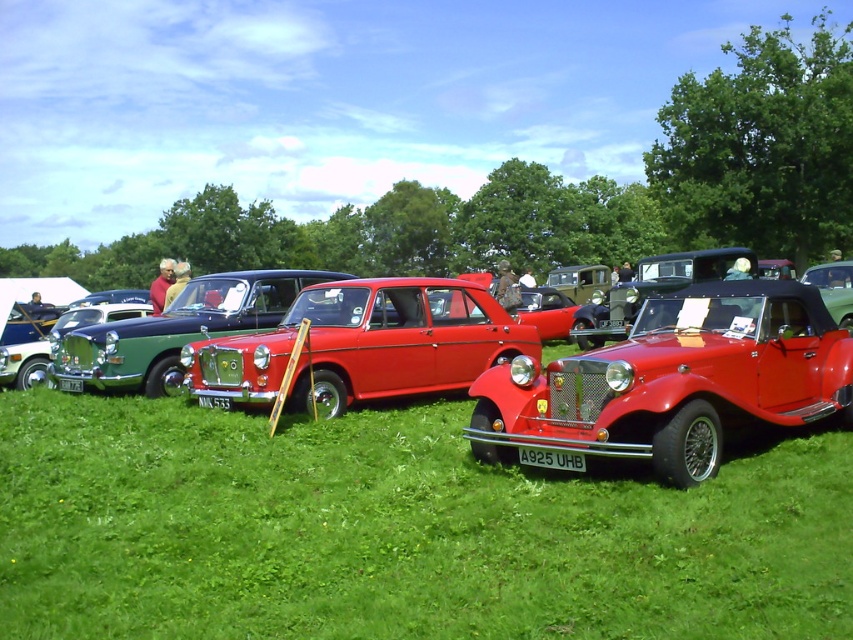
You are standing at the viewpoint of the image and see two points marked on the ground. The first point is at coordinate point(799,362) and the second point is at point(152,321). Which point is closer to you?

A: Point(799,362) is closer to you because it is in front of point(152,321).

Based on the photo, you are standing in front of the vintage cars and want to take a photo. You notice two points marked in the scene. Which point, point (486, 305) or point (178, 378), is closer to your camera when taking the photo?

Point (486, 305) is further to the camera than point (178, 378), so the closer point to the camera is point (178, 378).